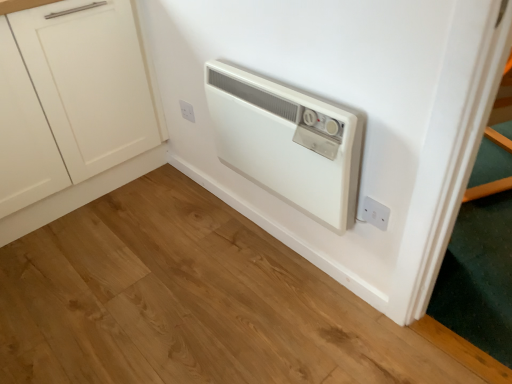
Question: Is white matte cabinet at left oriented away from white plastic electric outlet at upper center, which is counted as the first electric outlet, starting from the back?

Choices:
 (A) yes
 (B) no

Answer: (B)

Question: Is the depth of white matte cabinet at left greater than that of white plastic electric outlet at upper center, which is counted as the 2th electric outlet, starting from the bottom?

Choices:
 (A) yes
 (B) no

Answer: (B)

Question: Is white matte cabinet at left to the left of white plastic electric outlet at upper center, arranged as the second electric outlet when viewed from the right, from the viewer's perspective?

Choices:
 (A) yes
 (B) no

Answer: (A)

Question: Is white matte cabinet at left not within white plastic electric outlet at upper center, which is counted as the 2th electric outlet, starting from the bottom?

Choices:
 (A) yes
 (B) no

Answer: (A)

Question: Considering the relative sizes of white matte cabinet at left and white plastic electric outlet at upper center, positioned as the 1th electric outlet in top-to-bottom order, in the image provided, is white matte cabinet at left bigger than white plastic electric outlet at upper center, positioned as the 1th electric outlet in top-to-bottom order,?

Choices:
 (A) no
 (B) yes

Answer: (B)

Question: Does white matte cabinet at left contain white plastic electric outlet at upper center, positioned as the first electric outlet in left-to-right order?

Choices:
 (A) yes
 (B) no

Answer: (B)

Question: Considering the relative sizes of white plastic electric outlet at lower right, the 1th electric outlet in the front-to-back sequence, and white plastic electric outlet at upper center, which is counted as the first electric outlet, starting from the back, in the image provided, is white plastic electric outlet at lower right, the 1th electric outlet in the front-to-back sequence, taller than white plastic electric outlet at upper center, which is counted as the first electric outlet, starting from the back,?

Choices:
 (A) yes
 (B) no

Answer: (A)

Question: From a real-world perspective, is white plastic electric outlet at lower right, marked as the 1th electric outlet in a bottom-to-top arrangement, under white plastic electric outlet at upper center, arranged as the second electric outlet when viewed from the right?

Choices:
 (A) no
 (B) yes

Answer: (B)

Question: Is white plastic electric outlet at upper center, arranged as the second electric outlet when viewed from the right, located within white plastic electric outlet at lower right, which is counted as the second electric outlet, starting from the back?

Choices:
 (A) no
 (B) yes

Answer: (A)

Question: From a real-world perspective, is white plastic electric outlet at lower right, marked as the 1th electric outlet in a bottom-to-top arrangement, on white plastic electric outlet at upper center, which is counted as the first electric outlet, starting from the back?

Choices:
 (A) yes
 (B) no

Answer: (B)

Question: Is white plastic electric outlet at lower right, marked as the 1th electric outlet in a bottom-to-top arrangement, to the right of white plastic electric outlet at upper center, which is counted as the 2th electric outlet, starting from the bottom, from the viewer's perspective?

Choices:
 (A) no
 (B) yes

Answer: (B)

Question: Considering the relative sizes of white plastic electric outlet at lower right, marked as the 1th electric outlet in a bottom-to-top arrangement, and white plastic electric outlet at upper center, positioned as the first electric outlet in left-to-right order, in the image provided, is white plastic electric outlet at lower right, marked as the 1th electric outlet in a bottom-to-top arrangement, thinner than white plastic electric outlet at upper center, positioned as the first electric outlet in left-to-right order,?

Choices:
 (A) no
 (B) yes

Answer: (B)

Question: From the image's perspective, is white plastic heater at center under white plastic electric outlet at upper center, placed as the second electric outlet when sorted from front to back?

Choices:
 (A) yes
 (B) no

Answer: (A)